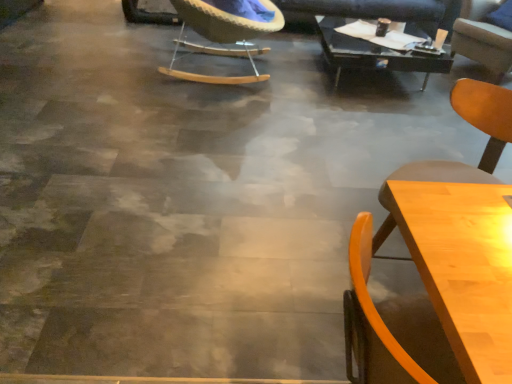
Question: From the image's perspective, relative to wooden table at lower right, which is the second table from back to front, is black glass table at upper center, the second table when ordered from left to right, above or below?

Choices:
 (A) below
 (B) above

Answer: (B)

Question: Is black glass table at upper center, the 1th table viewed from the top, to the left or to the right of wooden table at lower right, which is the 1th table from front to back, in the image?

Choices:
 (A) left
 (B) right

Answer: (B)

Question: Which is nearer to the black glass table at upper center, which is counted as the first table, starting from the back?

Choices:
 (A) light brown wood chair at upper right, which is counted as the 1th chair, starting from the right
 (B) woven fabric chair at upper center, the second chair when ordered from back to front
 (C) light wood chair at lower right, the 2th chair when ordered from right to left
 (D) wooden table at lower right, the second table when ordered from top to bottom

Answer: (A)

Question: Considering the real-world distances, which object is closest to the black glass table at upper center, acting as the first table starting from the right?

Choices:
 (A) wooden table at lower right, arranged as the first table when ordered from the bottom
 (B) light wood chair at lower right, the 2th chair when ordered from right to left
 (C) woven fabric chair at upper center, the second chair when ordered from back to front
 (D) light brown wood chair at upper right, the first chair in the back-to-front sequence

Answer: (D)